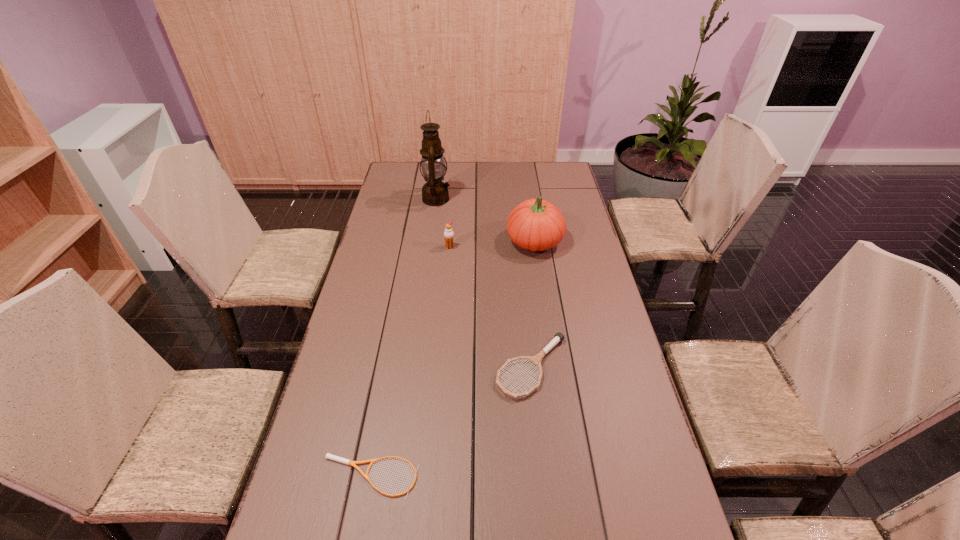
Where is `free location located at the front with a straw on the icecream`? The height and width of the screenshot is (540, 960). free location located at the front with a straw on the icecream is located at coordinates (446, 282).

The image size is (960, 540). In order to click on vacant space located 0.090m on the back of the farther tennis racket in this screenshot , I will do `click(526, 315)`.

In order to click on free point located on the front of the left tennis racket in this screenshot , I will do `click(361, 525)`.

This screenshot has width=960, height=540. I want to click on object that is at the left edge, so coord(328,456).

Locate an element on the screen. object that is positioned at the right edge is located at coordinates (535, 224).

In the image, there is a desktop. What are the coordinates of `free region at the far edge` in the screenshot? It's located at (492, 172).

The height and width of the screenshot is (540, 960). Identify the location of vacant space at the left edge of the desktop. (303, 476).

In the image, there is a desktop. Where is `vacant space at the right edge`? The image size is (960, 540). vacant space at the right edge is located at coordinates (607, 517).

The width and height of the screenshot is (960, 540). Identify the location of vacant region at the far left corner. (398, 180).

This screenshot has height=540, width=960. Identify the location of free point between the third tallest object and the nearer tennis racket. (410, 362).